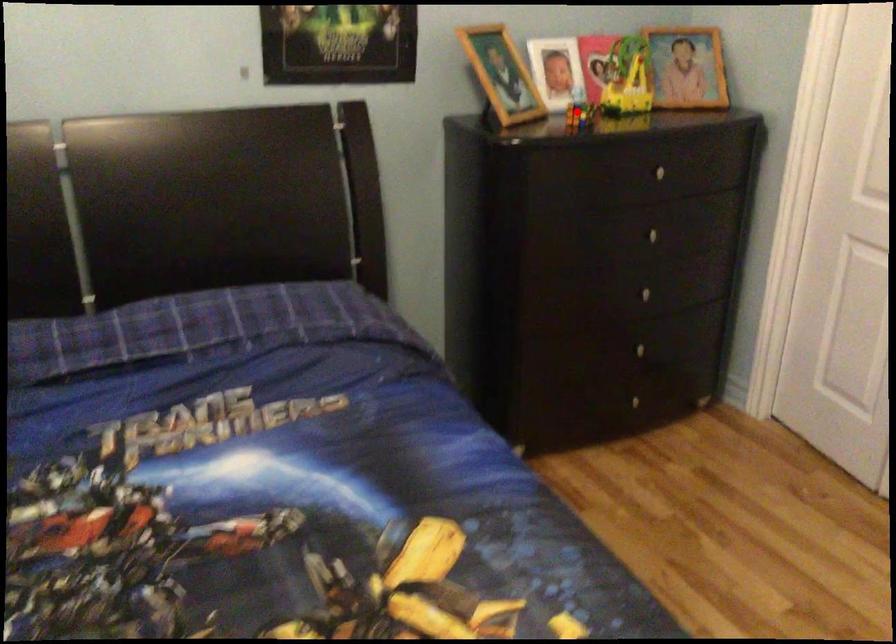
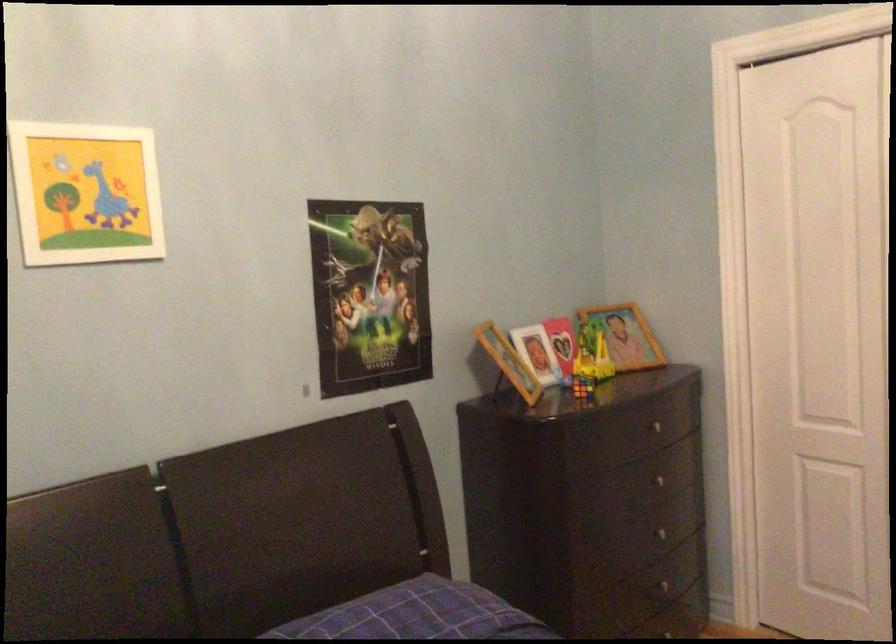
Question: I am providing you with two images of the same scene from different viewpoints. In image1, a red point is highlighted. Considering the same 3D point in image2, which of the following is correct?

Choices:
 (A) It is closer
 (B) It is farther

Answer: (B)